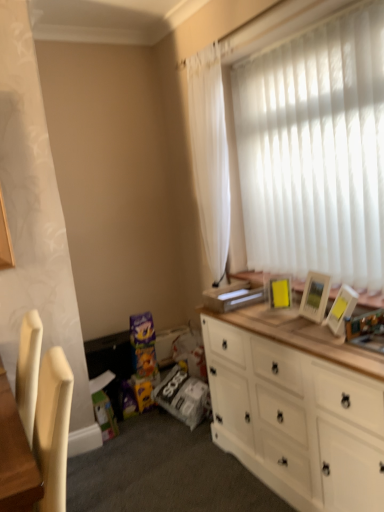
Describe the element at coordinates (210, 155) in the screenshot. The image size is (384, 512). I see `white sheer curtain at upper right` at that location.

Measure the distance between point (339, 376) and camera.

A distance of 1.61 meters exists between point (339, 376) and camera.

This screenshot has height=512, width=384. What are the coordinates of `yellow matte picture frame at upper right, which appears as the 1th picture frame when viewed from the back` in the screenshot? It's located at (280, 293).

Identify the location of white glossy picture frame at upper right, the first picture frame in the right-to-left sequence. (341, 310).

Find the location of `the 2nd picture frame below when counting from the white sheer curtain at upper right (from the image's perspective)`. the 2nd picture frame below when counting from the white sheer curtain at upper right (from the image's perspective) is located at coordinates (341, 310).

From the image's perspective, does white sheer curtain at upper right appear higher than white glossy picture frame at upper right, the first picture frame in the right-to-left sequence?

Indeed, from the image's perspective, white sheer curtain at upper right is shown above white glossy picture frame at upper right, the first picture frame in the right-to-left sequence.

Based on the photo, is white sheer curtain at upper right positioned with its back to white glossy picture frame at upper right, acting as the second picture frame starting from the left?

No, white glossy picture frame at upper right, acting as the second picture frame starting from the left, is not at the back of white sheer curtain at upper right.

What's the angular difference between white sheer curtain at upper right and white glossy picture frame at upper right, acting as the second picture frame starting from the left,'s facing directions?

The facing directions of white sheer curtain at upper right and white glossy picture frame at upper right, acting as the second picture frame starting from the left, are 39.3 degrees apart.

Is white sheer curtain at upper right not near white wood cabinet at right?

Yes, white sheer curtain at upper right is far from white wood cabinet at right.

Is white wood cabinet at right a part of white sheer curtain at upper right?

No, white wood cabinet at right is not a part of white sheer curtain at upper right.

From the image's perspective, which one is positioned lower, white sheer curtain at upper right or white wood cabinet at right?

white wood cabinet at right is shown below in the image.

Considering the relative sizes of white sheer curtain at upper right and white wood cabinet at right in the image provided, is white sheer curtain at upper right bigger than white wood cabinet at right?

Incorrect, white sheer curtain at upper right is not larger than white wood cabinet at right.

Consider the image. From the image's perspective, is white sheer curtain at upper right on yellow matte picture frame at upper right, which appears as the second picture frame when viewed from the front?

Indeed, from the image's perspective, white sheer curtain at upper right is shown above yellow matte picture frame at upper right, which appears as the second picture frame when viewed from the front.

Considering the sizes of objects white sheer curtain at upper right and yellow matte picture frame at upper right, which appears as the second picture frame when viewed from the front, in the image provided, who is thinner, white sheer curtain at upper right or yellow matte picture frame at upper right, which appears as the second picture frame when viewed from the front,?

yellow matte picture frame at upper right, which appears as the second picture frame when viewed from the front.

What are the coordinates of `curtain behind the yellow matte picture frame at upper right, which appears as the second picture frame when viewed from the front` in the screenshot? It's located at (210, 155).

Between white sheer curtain at upper right and yellow matte picture frame at upper right, which appears as the second picture frame when viewed from the front, which one has smaller size?

Smaller between the two is yellow matte picture frame at upper right, which appears as the second picture frame when viewed from the front.

Is white wood cabinet at right at the back of yellow matte picture frame at upper right, the first picture frame from the left?

No, yellow matte picture frame at upper right, the first picture frame from the left, is not facing away from white wood cabinet at right.

Considering the positions of points (278, 295) and (362, 351), is point (278, 295) farther from camera compared to point (362, 351)?

Yes, it is.

Is yellow matte picture frame at upper right, which appears as the second picture frame when viewed from the front, positioned far away from white wood cabinet at right?

No, yellow matte picture frame at upper right, which appears as the second picture frame when viewed from the front, is not far from white wood cabinet at right.

Where is `cabinetry that is below the yellow matte picture frame at upper right, which appears as the second picture frame when viewed from the front (from the image's perspective)`? The height and width of the screenshot is (512, 384). cabinetry that is below the yellow matte picture frame at upper right, which appears as the second picture frame when viewed from the front (from the image's perspective) is located at coordinates (297, 407).

From the image's perspective, which one is positioned higher, white glossy picture frame at upper right, which is counted as the 1th picture frame, starting from the front, or white wood cabinet at right?

white glossy picture frame at upper right, which is counted as the 1th picture frame, starting from the front, appears higher in the image.

Considering the relative sizes of white glossy picture frame at upper right, the first picture frame in the right-to-left sequence, and white wood cabinet at right in the image provided, is white glossy picture frame at upper right, the first picture frame in the right-to-left sequence, taller than white wood cabinet at right?

No.

Looking at this image, in the image, is white glossy picture frame at upper right, the first picture frame in the right-to-left sequence, positioned in front of or behind white wood cabinet at right?

white glossy picture frame at upper right, the first picture frame in the right-to-left sequence, is positioned farther from the viewer than white wood cabinet at right.

Is white glossy picture frame at upper right, the first picture frame in the right-to-left sequence, next to white wood cabinet at right?

white glossy picture frame at upper right, the first picture frame in the right-to-left sequence, and white wood cabinet at right are clearly separated.

In the scene shown: Which is closer, (270, 281) or (343, 296)?

Point (343, 296)

Are yellow matte picture frame at upper right, the first picture frame from the left, and white glossy picture frame at upper right, acting as the second picture frame starting from the left, far apart?

yellow matte picture frame at upper right, the first picture frame from the left, is near white glossy picture frame at upper right, acting as the second picture frame starting from the left, not far away.

Is yellow matte picture frame at upper right, which appears as the 1th picture frame when viewed from the back, facing away from white glossy picture frame at upper right, acting as the second picture frame starting from the left?

No, white glossy picture frame at upper right, acting as the second picture frame starting from the left, is not at the back of yellow matte picture frame at upper right, which appears as the 1th picture frame when viewed from the back.

How far apart are yellow matte picture frame at upper right, the second picture frame in the right-to-left sequence, and white glossy picture frame at upper right, the first picture frame in the right-to-left sequence?

They are 34.55 centimeters apart.

Does white glossy picture frame at upper right, which is the second picture frame in back-to-front order, turn towards white sheer curtain at upper right?

No, white glossy picture frame at upper right, which is the second picture frame in back-to-front order, is not facing towards white sheer curtain at upper right.

From the image's perspective, which object appears higher, white glossy picture frame at upper right, acting as the second picture frame starting from the left, or white sheer curtain at upper right?

From the image's view, white sheer curtain at upper right is above.

This screenshot has height=512, width=384. I want to click on curtain located above the white glossy picture frame at upper right, which is counted as the 1th picture frame, starting from the front (from a real-world perspective), so (210, 155).

Find the location of a particular element. This screenshot has width=384, height=512. curtain located above the white glossy picture frame at upper right, which is the second picture frame in back-to-front order (from a real-world perspective) is located at coordinates [x=210, y=155].

This screenshot has height=512, width=384. I want to click on cabinetry on the right of white sheer curtain at upper right, so click(x=297, y=407).

When comparing their distances from white glossy picture frame at upper right, which is counted as the 1th picture frame, starting from the front, does white sheer curtain at upper right or yellow matte picture frame at upper right, the first picture frame from the left, seem further?

white sheer curtain at upper right lies further to white glossy picture frame at upper right, which is counted as the 1th picture frame, starting from the front, than the other object.

Estimate the real-world distances between objects in this image. Which object is further from white wood cabinet at right, white sheer curtain at upper right or yellow matte picture frame at upper right, which appears as the second picture frame when viewed from the front?

Based on the image, white sheer curtain at upper right appears to be further to white wood cabinet at right.

Considering their positions, is white glossy picture frame at upper right, which is counted as the 1th picture frame, starting from the front, positioned closer to white wood cabinet at right than yellow matte picture frame at upper right, the first picture frame from the left?

Based on the image, white glossy picture frame at upper right, which is counted as the 1th picture frame, starting from the front, appears to be nearer to white wood cabinet at right.

Which object lies nearer to the anchor point white glossy picture frame at upper right, which is the second picture frame in back-to-front order, yellow matte picture frame at upper right, the first picture frame from the left, or white wood cabinet at right?

yellow matte picture frame at upper right, the first picture frame from the left, is closer to white glossy picture frame at upper right, which is the second picture frame in back-to-front order.

Considering their positions, is white sheer curtain at upper right positioned closer to yellow matte picture frame at upper right, which appears as the second picture frame when viewed from the front, than white glossy picture frame at upper right, the first picture frame in the right-to-left sequence?

white glossy picture frame at upper right, the first picture frame in the right-to-left sequence, lies closer to yellow matte picture frame at upper right, which appears as the second picture frame when viewed from the front, than the other object.

Which object lies further to the anchor point white glossy picture frame at upper right, which is counted as the 1th picture frame, starting from the front, yellow matte picture frame at upper right, which appears as the 1th picture frame when viewed from the back, or white sheer curtain at upper right?

white sheer curtain at upper right is positioned further to the anchor white glossy picture frame at upper right, which is counted as the 1th picture frame, starting from the front.

Considering their positions, is white glossy picture frame at upper right, the first picture frame in the right-to-left sequence, positioned further to white sheer curtain at upper right than yellow matte picture frame at upper right, the first picture frame from the left?

white glossy picture frame at upper right, the first picture frame in the right-to-left sequence, lies further to white sheer curtain at upper right than the other object.

Estimate the real-world distances between objects in this image. Which object is closer to white sheer curtain at upper right, white wood cabinet at right or yellow matte picture frame at upper right, the first picture frame from the left?

yellow matte picture frame at upper right, the first picture frame from the left, lies closer to white sheer curtain at upper right than the other object.

Locate an element on the screen. The width and height of the screenshot is (384, 512). picture frame between white sheer curtain at upper right and white glossy picture frame at upper right, acting as the second picture frame starting from the left, in the vertical direction is located at coordinates (280, 293).

The height and width of the screenshot is (512, 384). I want to click on picture frame positioned between white wood cabinet at right and yellow matte picture frame at upper right, the first picture frame from the left, from near to far, so click(x=341, y=310).